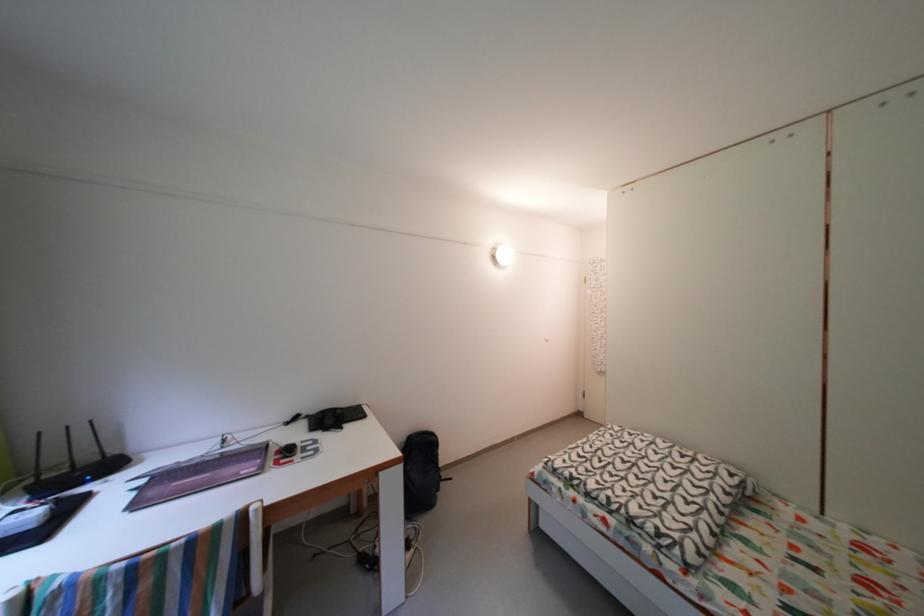
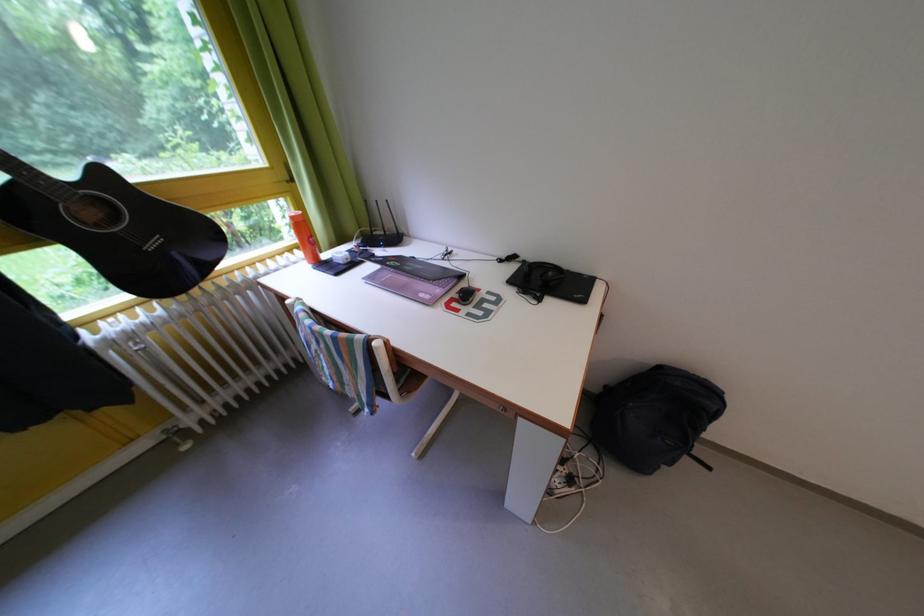
Locate, in the second image, the point that corresponds to pixel 415 445 in the first image.

(663, 370)